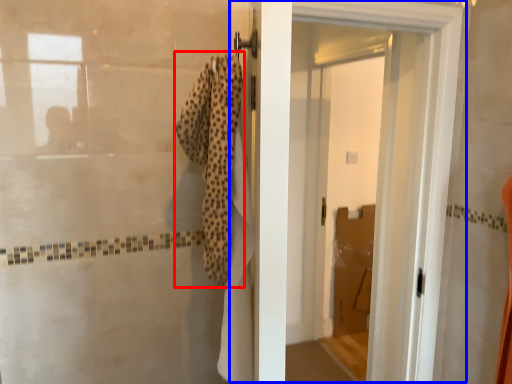
Question: Which point is further to the camera, bath towel (highlighted by a red box) or door (highlighted by a blue box)?

Choices:
 (A) bath towel
 (B) door

Answer: (B)